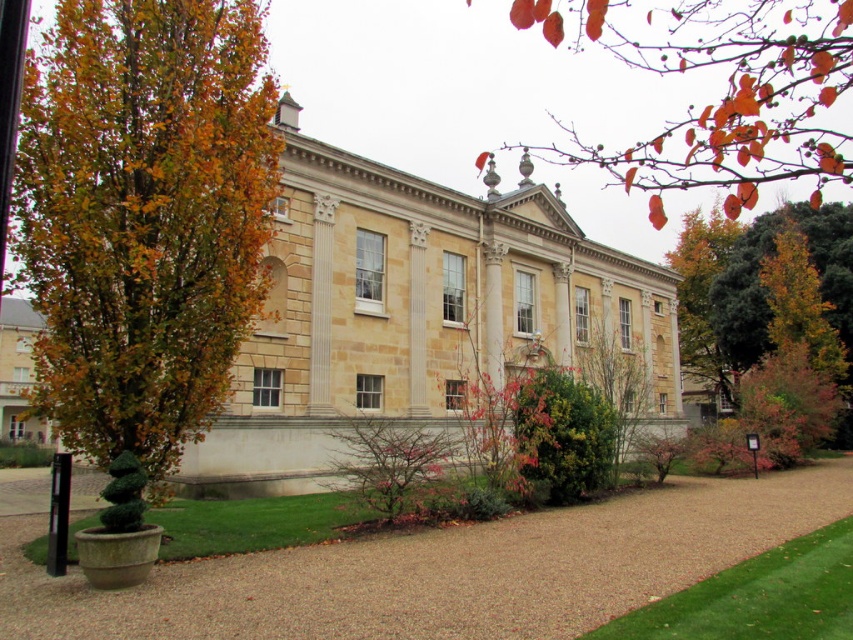
Question: Which point is closer to the camera taking this photo?

Choices:
 (A) (804, 554)
 (B) (340, 464)
 (C) (682, 243)

Answer: (A)

Question: Does golden-brown foliage at left appear on the left side of green grass at lower right?

Choices:
 (A) no
 (B) yes

Answer: (B)

Question: Estimate the real-world distances between objects in this image. Which object is closer to the pink textured bush at center?

Choices:
 (A) orange leafy branch at upper right
 (B) golden-brown foliage at left
 (C) gravel at center
 (D) green grass at lower right

Answer: (C)

Question: Is green leafy tree at center thinner than pink textured bush at center?

Choices:
 (A) no
 (B) yes

Answer: (A)

Question: Which of the following is the farthest from the observer?

Choices:
 (A) (422, 435)
 (B) (666, 632)

Answer: (A)

Question: From the image, what is the correct spatial relationship of gravel at center in relation to green grass at lower right?

Choices:
 (A) above
 (B) below

Answer: (B)